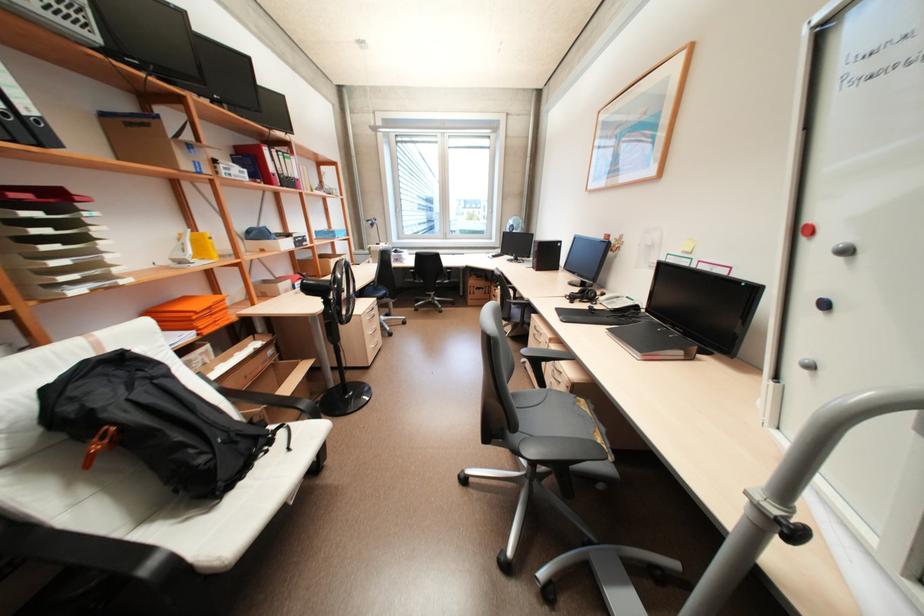
Image resolution: width=924 pixels, height=616 pixels. I want to click on black chair armrest, so click(x=543, y=355).